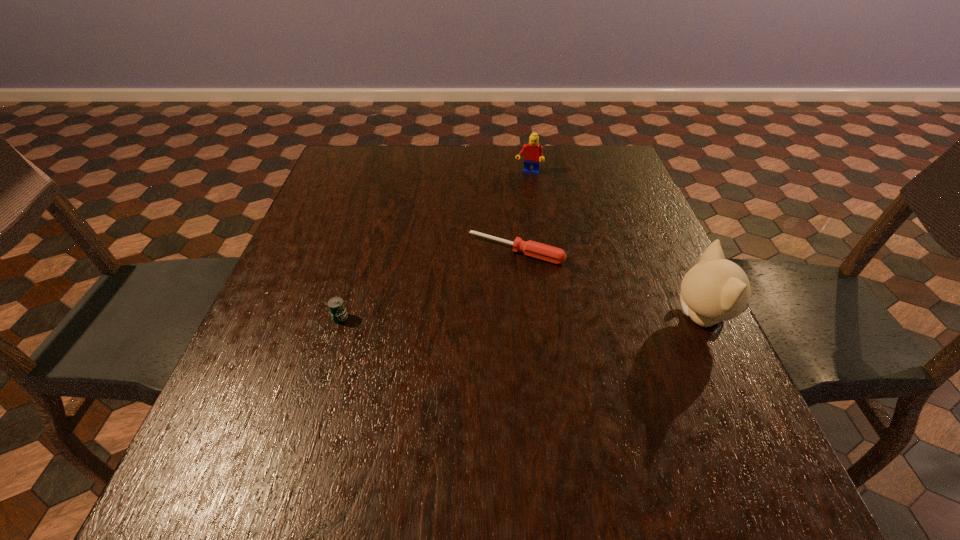
Locate an element on the screen. vacant space located on the front-facing side of the Lego is located at coordinates (512, 225).

Where is `vacant point located on the front-facing side of the Lego`? The width and height of the screenshot is (960, 540). vacant point located on the front-facing side of the Lego is located at coordinates (504, 249).

Where is `vacant space situated 0.100m at the blade of the shortest object`? This screenshot has height=540, width=960. vacant space situated 0.100m at the blade of the shortest object is located at coordinates (479, 294).

Locate an element on the screen. The image size is (960, 540). blank space located at the blade of the shortest object is located at coordinates (432, 370).

Where is `free space located 0.330m at the blade of the shortest object`? The width and height of the screenshot is (960, 540). free space located 0.330m at the blade of the shortest object is located at coordinates (426, 378).

Locate an element on the screen. The width and height of the screenshot is (960, 540). object situated at the far edge is located at coordinates (534, 152).

Locate an element on the screen. This screenshot has width=960, height=540. object situated at the left edge is located at coordinates (336, 306).

In order to click on object located at the right edge in this screenshot , I will do `click(716, 289)`.

This screenshot has width=960, height=540. In order to click on vacant space at the far edge of the desktop in this screenshot , I will do `click(492, 187)`.

In order to click on free space at the near edge of the desktop in this screenshot , I will do `click(612, 401)`.